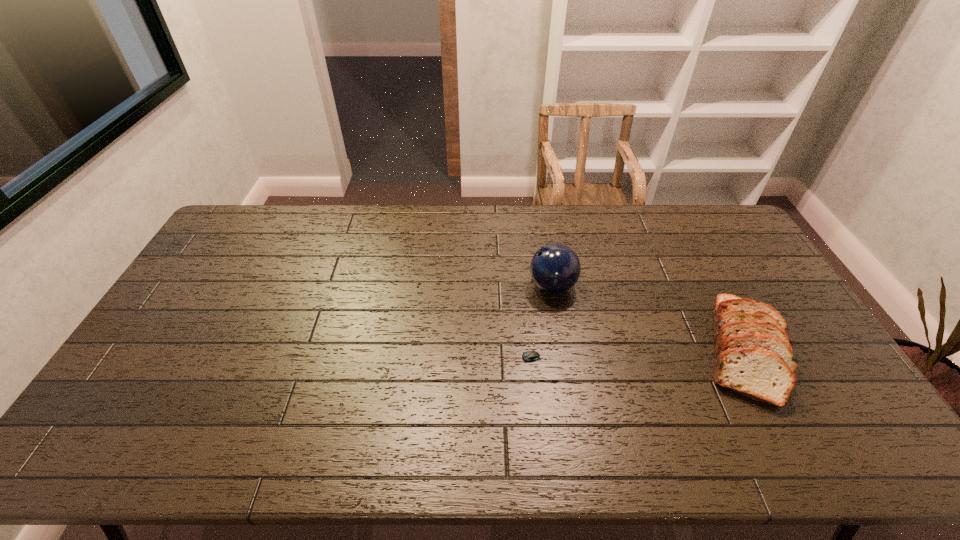
Where is `vacant area that lies between the rightmost object and the shortest object`? vacant area that lies between the rightmost object and the shortest object is located at coordinates (x=632, y=354).

The image size is (960, 540). In order to click on empty location between the mouse and the tallest object in this screenshot , I will do `click(536, 321)`.

The image size is (960, 540). What are the coordinates of `free space between the second shortest object and the bowling ball` in the screenshot? It's located at (648, 318).

The height and width of the screenshot is (540, 960). In order to click on vacant space that is in between the shortest object and the bread in this screenshot , I will do [x=632, y=354].

Find the location of a particular element. This screenshot has width=960, height=540. vacant area that lies between the rightmost object and the bowling ball is located at coordinates (648, 318).

At what (x,y) coordinates should I click in order to perform the action: click on free spot between the second tallest object and the tallest object. Please return your answer as a coordinate pair (x, y). The image size is (960, 540). Looking at the image, I should click on (648, 318).

Image resolution: width=960 pixels, height=540 pixels. I want to click on free spot between the bowling ball and the shortest object, so click(536, 321).

Find the location of `object that is the nearest to the mouse`. object that is the nearest to the mouse is located at coordinates coord(555,268).

The width and height of the screenshot is (960, 540). In order to click on the second closest object relative to the tallest object in this screenshot , I will do `click(753, 355)`.

Where is `vacant space that satisfies the following two spatial constraints: 1. on the surface of the second shortest object near the finger holes; 2. on the right side of the bowling ball`? The image size is (960, 540). vacant space that satisfies the following two spatial constraints: 1. on the surface of the second shortest object near the finger holes; 2. on the right side of the bowling ball is located at coordinates (563, 350).